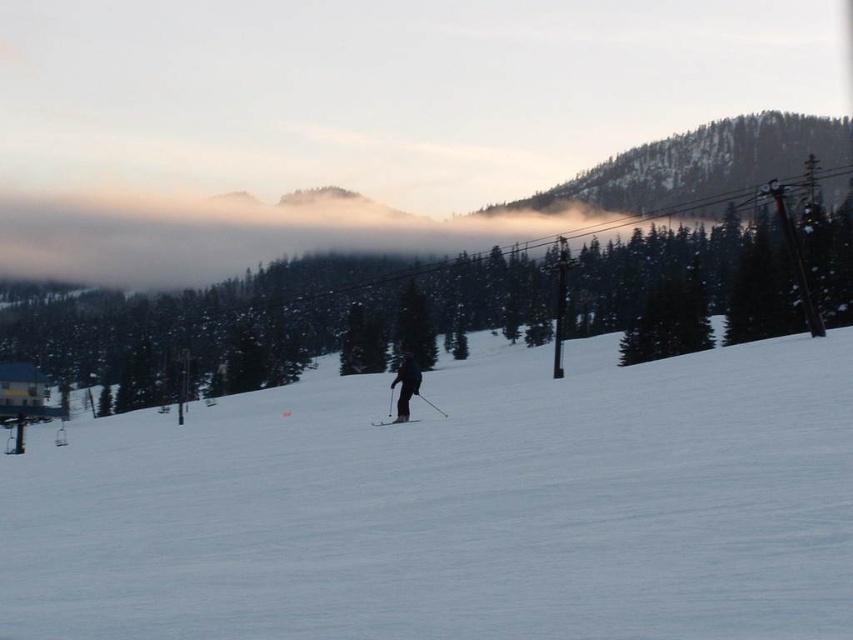
Which is more to the left, dark blue ski suit at center or matte black ski at center?

matte black ski at center is more to the left.

Which is behind, point (416, 378) or point (374, 422)?

The point (416, 378) is behind.

At what (x,y) coordinates should I click in order to perform the action: click on dark blue ski suit at center. Please return your answer as a coordinate pair (x, y). The image size is (853, 640). Looking at the image, I should click on (405, 385).

Is point (312, 586) in front of point (384, 420)?

Yes, point (312, 586) is closer to viewer.

Where is `white snow ski slope at center`? The image size is (853, 640). white snow ski slope at center is located at coordinates (456, 506).

Which is in front, point (16, 513) or point (401, 420)?

Positioned in front is point (16, 513).

What are the coordinates of `white snow ski slope at center` in the screenshot? It's located at (456, 506).

Does white snow ski slope at center have a greater width compared to dark blue ski suit at center?

Correct, the width of white snow ski slope at center exceeds that of dark blue ski suit at center.

Who is more forward, [666,593] or [395,378]?

Positioned in front is point [666,593].

Locate an element on the screen. This screenshot has height=640, width=853. white snow ski slope at center is located at coordinates (456, 506).